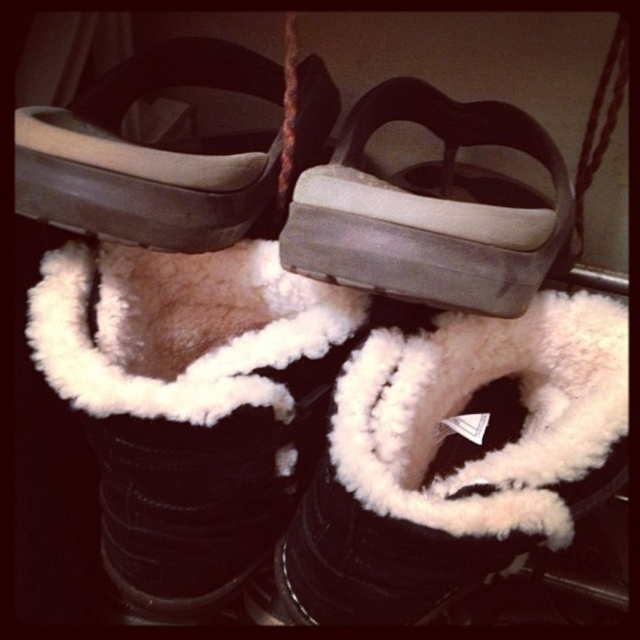
You are organizing your closet and see the white fluffy boot at center and the gray rubber sandal at center. Which one is positioned lower in the closet?

The white fluffy boot at center is located below the gray rubber sandal at center, so it is positioned lower in the closet.

You are a delivery robot with a height of 3 feet. You need to place a package on the gray rubber sandal at center. Can you reach it?

The gray rubber sandal at center and viewer are 18.88 inches apart. Since the robot is 3 feet tall, which is 36 inches, it can easily reach the gray rubber sandal at center as the distance is within its height.

In the scene shown: You are organizing your closet and see the point at coordinates (460, 458). What object is located at that point?

The point at coordinates (460, 458) indicates the white fluffy boot at center.